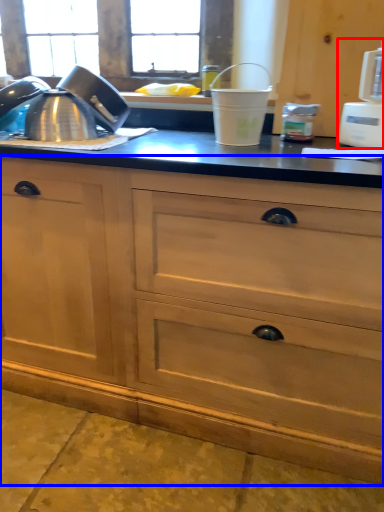
Question: Which point is closer to the camera, appliance (highlighted by a red box) or cabinetry (highlighted by a blue box)?

Choices:
 (A) appliance
 (B) cabinetry

Answer: (B)